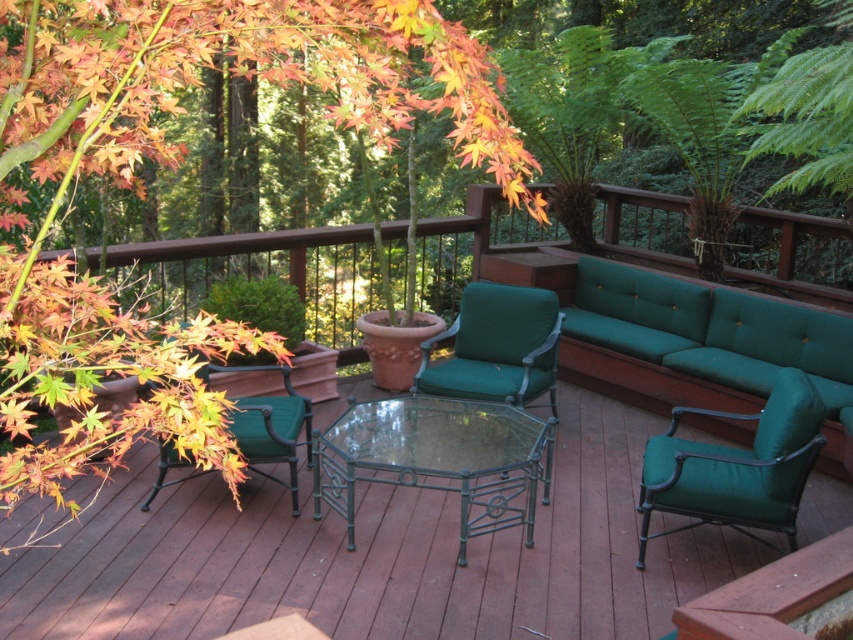
Measure the distance between matte orange maple leaves at upper left and camera.

matte orange maple leaves at upper left and camera are 1.47 meters apart.

Can you confirm if matte orange maple leaves at upper left is positioned to the right of clear glass table at center?

In fact, matte orange maple leaves at upper left is to the left of clear glass table at center.

The image size is (853, 640). Describe the element at coordinates (173, 163) in the screenshot. I see `matte orange maple leaves at upper left` at that location.

Where is `matte orange maple leaves at upper left`? The height and width of the screenshot is (640, 853). matte orange maple leaves at upper left is located at coordinates (173, 163).

Can you confirm if green fabric armchair at right is positioned above green fabric armchair at left?

Actually, green fabric armchair at right is below green fabric armchair at left.

Does green fabric armchair at right have a lesser width compared to green fabric armchair at left?

In fact, green fabric armchair at right might be wider than green fabric armchair at left.

Locate an element on the screen. green fabric armchair at right is located at coordinates (737, 467).

Locate an element on the screen. green fabric armchair at right is located at coordinates [737, 467].

Is matte orange maple leaves at upper left above green fabric armchair at right?

Indeed, matte orange maple leaves at upper left is positioned over green fabric armchair at right.

Identify the location of matte orange maple leaves at upper left. This screenshot has width=853, height=640. (173, 163).